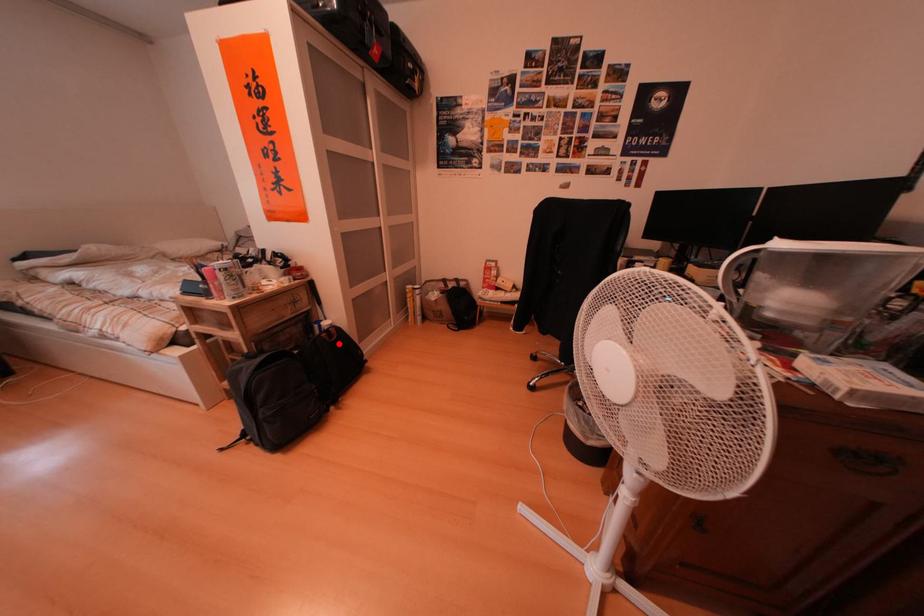
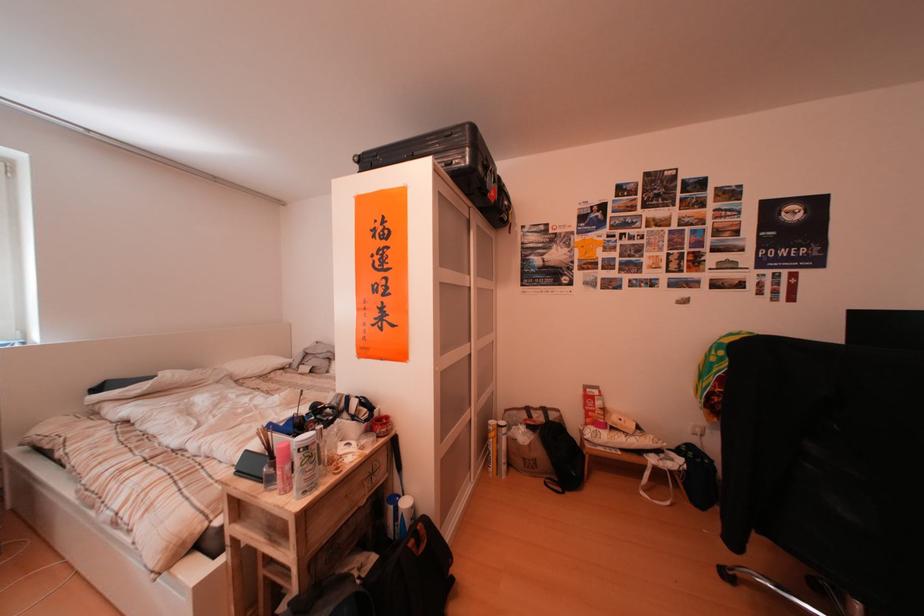
Where in the second image is the point corresponding to the highlighted location from the first image?

(428, 556)